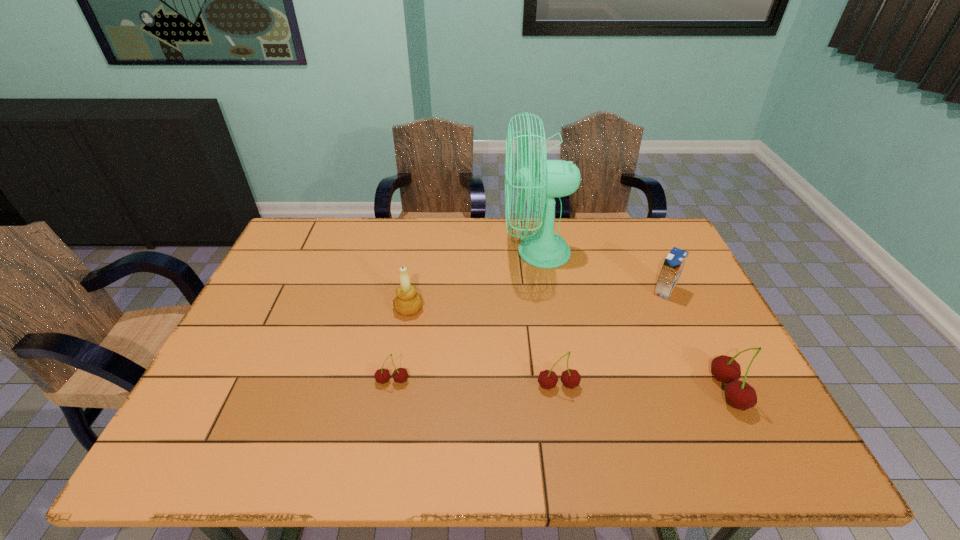
Locate an element on the screen. The image size is (960, 540). vacant space in between the tallest cherry and the second tallest cherry is located at coordinates [642, 388].

Find the location of a particular element. The height and width of the screenshot is (540, 960). vacant space that is in between the tallest object and the orange_juice is located at coordinates point(600,272).

Find the location of a particular element. vacant area that lies between the rightmost cherry and the shortest object is located at coordinates (560, 386).

The width and height of the screenshot is (960, 540). What are the coordinates of `empty space that is in between the shortest cherry and the candle_holder` in the screenshot? It's located at (400, 345).

What are the coordinates of `free spot between the candle_holder and the orange_juice` in the screenshot? It's located at (537, 300).

Locate an element on the screen. The height and width of the screenshot is (540, 960). vacant area between the orange_juice and the candle_holder is located at coordinates (537, 300).

You are a GUI agent. You are given a task and a screenshot of the screen. Output one action in this format:
    pyautogui.click(x=<x>, y=<y>)
    Task: Click on the vacant space that is in between the candle_holder and the second cherry from left to right
    
    Given the screenshot: What is the action you would take?
    pyautogui.click(x=484, y=347)

The width and height of the screenshot is (960, 540). I want to click on object that is the closest one to the second shortest cherry, so click(x=400, y=375).

Point out which object is positioned as the third nearest to the second tallest cherry. Please provide its 2D coordinates. Your answer should be formatted as a tuple, i.e. [(x, y)], where the tuple contains the x and y coordinates of a point satisfying the conditions above.

[(545, 249)]

The height and width of the screenshot is (540, 960). I want to click on cherry that is the second nearest to the orange_juice, so click(x=570, y=378).